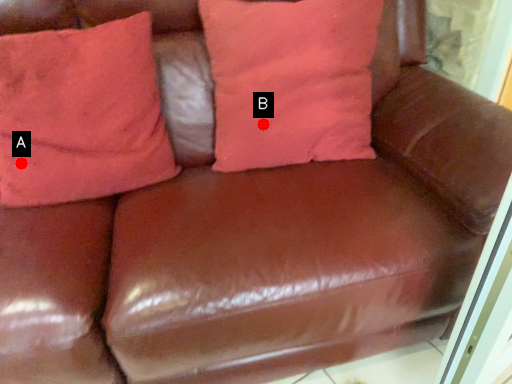
Question: Two points are circled on the image, labeled by A and B beside each circle. Which point is farther to the camera?

Choices:
 (A) A is further
 (B) B is further

Answer: (B)